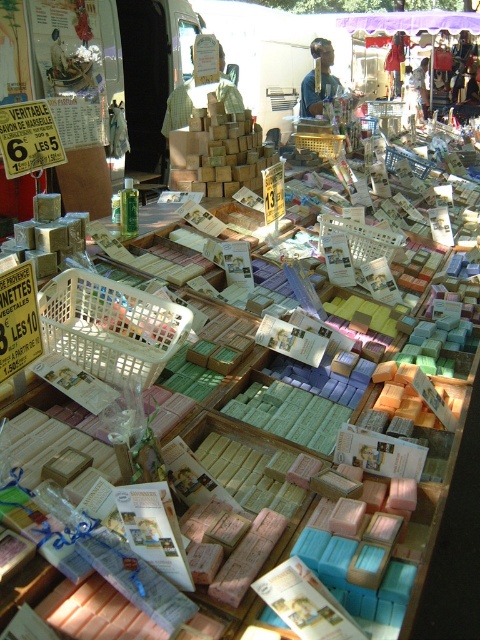
Can you confirm if matte brown wooden stick at upper center is taller than matte white shirt at upper center?

In fact, matte brown wooden stick at upper center may be shorter than matte white shirt at upper center.

Who is lower down, matte brown wooden stick at upper center or matte white shirt at upper center?

Positioned lower is matte brown wooden stick at upper center.

Is point (322, 74) positioned behind point (421, 67)?

No, it is not.

Identify the location of matte brown wooden stick at upper center. (321, 80).